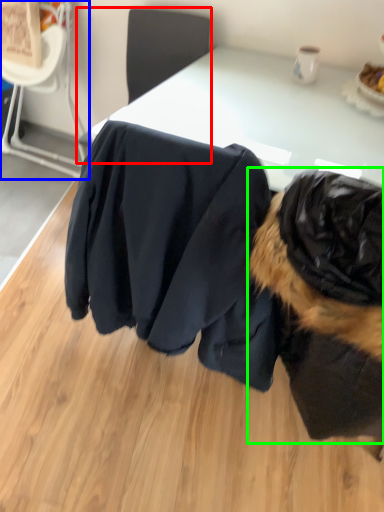
Question: Based on their relative distances, which object is farther from chair (highlighted by a red box)? Choose from chair (highlighted by a blue box) and dog (highlighted by a green box).

Choices:
 (A) chair
 (B) dog

Answer: (B)